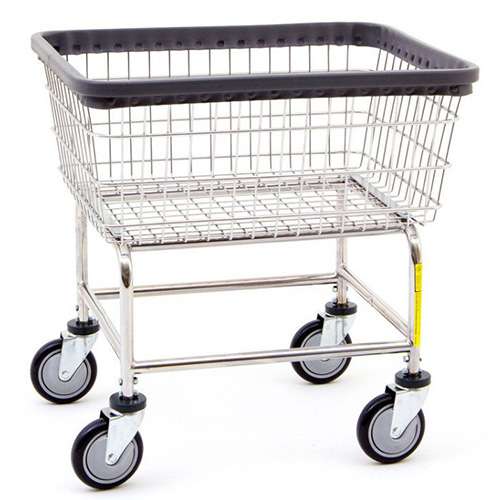
You are a GUI agent. You are given a task and a screenshot of the screen. Output one action in this format:
    pyautogui.click(x=<x>, y=<y>)
    Task: Click on the background wall
    The height and width of the screenshot is (500, 497).
    Given the screenshot: What is the action you would take?
    pyautogui.click(x=23, y=127)